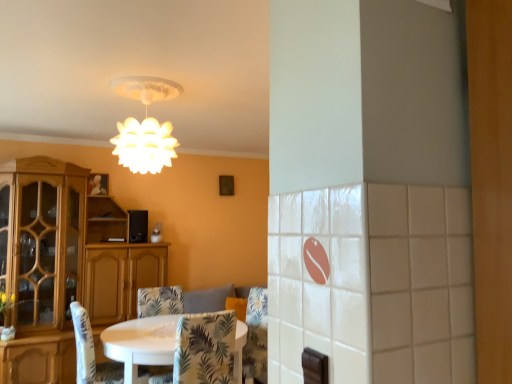
Question: Is white matte lampshade at upper center aimed at patterned fabric chair at center, which appears as the first chair when viewed from the front?

Choices:
 (A) no
 (B) yes

Answer: (A)

Question: Is white matte lampshade at upper center to the right of patterned fabric chair at center, which appears as the first chair when viewed from the front, from the viewer's perspective?

Choices:
 (A) no
 (B) yes

Answer: (A)

Question: Are white matte lampshade at upper center and patterned fabric chair at center, the third chair when ordered from back to front, beside each other?

Choices:
 (A) yes
 (B) no

Answer: (B)

Question: Is white matte lampshade at upper center closer to the viewer compared to patterned fabric chair at center, the third chair when ordered from back to front?

Choices:
 (A) no
 (B) yes

Answer: (A)

Question: Can you confirm if white matte lampshade at upper center is taller than patterned fabric chair at center, which appears as the first chair when viewed from the front?

Choices:
 (A) no
 (B) yes

Answer: (A)

Question: From a real-world perspective, is white matte lampshade at upper center positioned over patterned fabric chair at center, which appears as the first chair when viewed from the front, based on gravity?

Choices:
 (A) yes
 (B) no

Answer: (A)

Question: Does white fabric chair at lower left, the second chair viewed from the front, turn towards patterned fabric chair at center, which appears as the first chair when viewed from the front?

Choices:
 (A) yes
 (B) no

Answer: (B)

Question: Considering the relative sizes of white fabric chair at lower left, arranged as the 2th chair when viewed from the back, and patterned fabric chair at center, which appears as the first chair when viewed from the front, in the image provided, is white fabric chair at lower left, arranged as the 2th chair when viewed from the back, shorter than patterned fabric chair at center, which appears as the first chair when viewed from the front,?

Choices:
 (A) no
 (B) yes

Answer: (A)

Question: Is white fabric chair at lower left, the second chair viewed from the front, far from patterned fabric chair at center, the third chair when ordered from back to front?

Choices:
 (A) yes
 (B) no

Answer: (B)

Question: Is white fabric chair at lower left, arranged as the 2th chair when viewed from the back, smaller than patterned fabric chair at center, which appears as the first chair when viewed from the front?

Choices:
 (A) no
 (B) yes

Answer: (A)

Question: From a real-world perspective, is white fabric chair at lower left, the second chair viewed from the front, physically below patterned fabric chair at center, the third chair when ordered from back to front?

Choices:
 (A) no
 (B) yes

Answer: (B)

Question: Could patterned fabric chair at center, the third chair when ordered from back to front, be considered to be inside white fabric chair at lower left, arranged as the 2th chair when viewed from the back?

Choices:
 (A) no
 (B) yes

Answer: (A)

Question: Does patterned fabric chair at center, which appears as the first chair when viewed from the front, have a greater width compared to white matte lampshade at upper center?

Choices:
 (A) no
 (B) yes

Answer: (B)